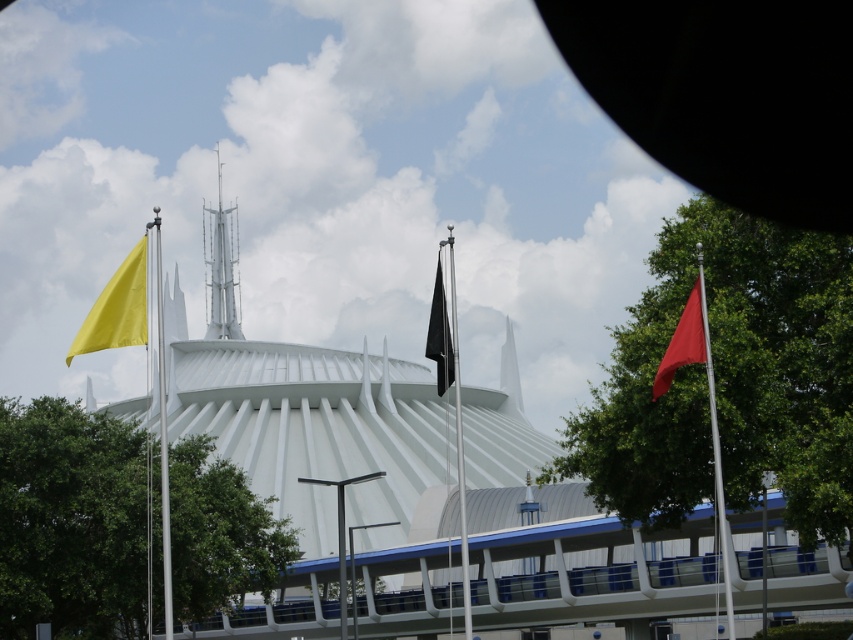
Based on the photo, who is shorter, yellow matte flag at left or white metallic spire at center?

yellow matte flag at left is shorter.

Is yellow matte flag at left taller than white metallic spire at center?

No.

Is point (128, 330) in front of point (219, 257)?

Yes, point (128, 330) is closer to viewer.

The height and width of the screenshot is (640, 853). In order to click on yellow matte flag at left in this screenshot , I will do `click(117, 308)`.

Who is lower down, white metallic spire at center or red matte flag at right?

Positioned lower is red matte flag at right.

Does white metallic spire at center have a greater height compared to red matte flag at right?

Indeed, white metallic spire at center has a greater height compared to red matte flag at right.

Which is in front, point (210, 237) or point (660, 365)?

Point (660, 365) is in front.

You are a GUI agent. You are given a task and a screenshot of the screen. Output one action in this format:
    pyautogui.click(x=<x>, y=<y>)
    Task: Click on the white metallic spire at center
    The image size is (853, 640).
    Given the screenshot: What is the action you would take?
    pyautogui.click(x=222, y=266)

Can you confirm if yellow matte flag at left is bigger than black matte flag at center?

Yes.

Which of these two, yellow matte flag at left or black matte flag at center, stands taller?

black matte flag at center

Find the location of a particular element. Image resolution: width=853 pixels, height=640 pixels. yellow matte flag at left is located at coordinates (117, 308).

What are the coordinates of `yellow matte flag at left` in the screenshot? It's located at (117, 308).